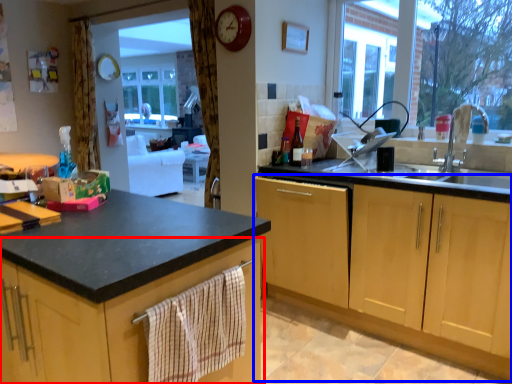
Question: Which object appears closest to the camera in this image, cabinetry (highlighted by a red box) or cabinetry (highlighted by a blue box)?

Choices:
 (A) cabinetry
 (B) cabinetry

Answer: (A)